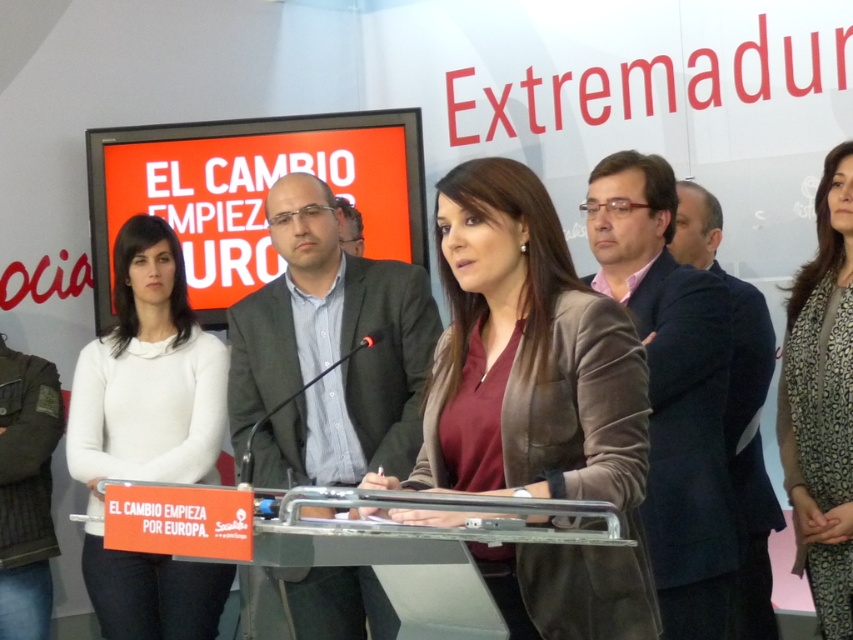
Question: Estimate the real-world distances between objects in this image. Which object is farther from the brown leather jacket at center?

Choices:
 (A) brown textured coat at center
 (B) white matte sweater at center

Answer: (B)

Question: Does brown leather jacket at center appear on the left side of white matte sweater at center?

Choices:
 (A) no
 (B) yes

Answer: (A)

Question: Does white matte sweater at center appear under brown textured coat at center?

Choices:
 (A) yes
 (B) no

Answer: (A)

Question: Which point appears closest to the camera in this image?

Choices:
 (A) (108, 362)
 (B) (589, 438)
 (C) (804, 385)

Answer: (B)

Question: Where is white matte sweater at center located in relation to brown textured coat at center in the image?

Choices:
 (A) left
 (B) right

Answer: (A)

Question: Which point is farther to the camera?

Choices:
 (A) (570, 595)
 (B) (824, 636)

Answer: (B)